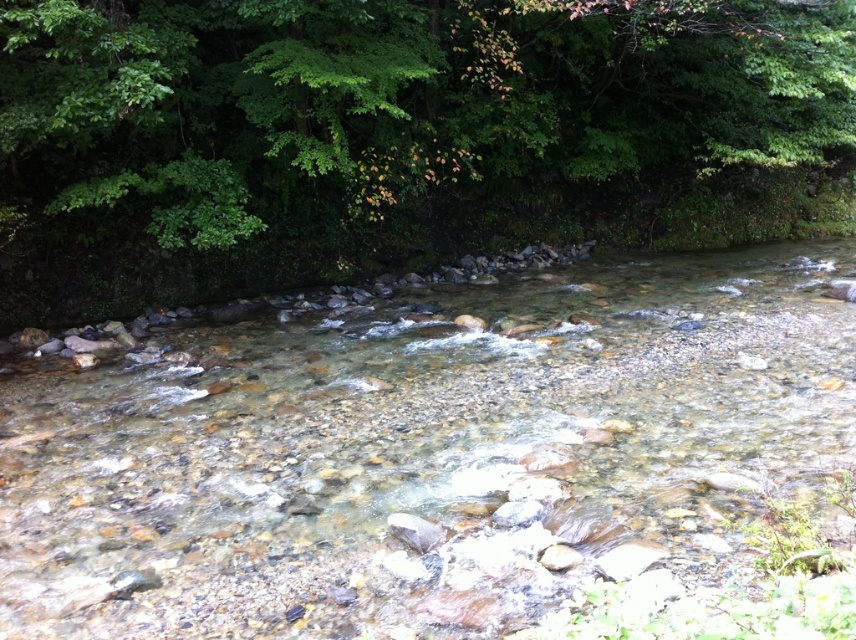
You are a hiker trying to cross the translucent rocky stream at center. There is a green leafy tree at upper center nearby. Which direction should you look to see the tree while standing in the stream?

The green leafy tree at upper center is above the translucent rocky stream at center, so you should look upward to see the tree while standing in the stream.

You are standing at the edge of the river and see two points marked in the scene. Which of the two points, point (627, 484) or point (843, 17), is closer to your current position?

Point (627, 484) is closer to the viewer than point (843, 17), so the closer point to your current position is point (627, 484).